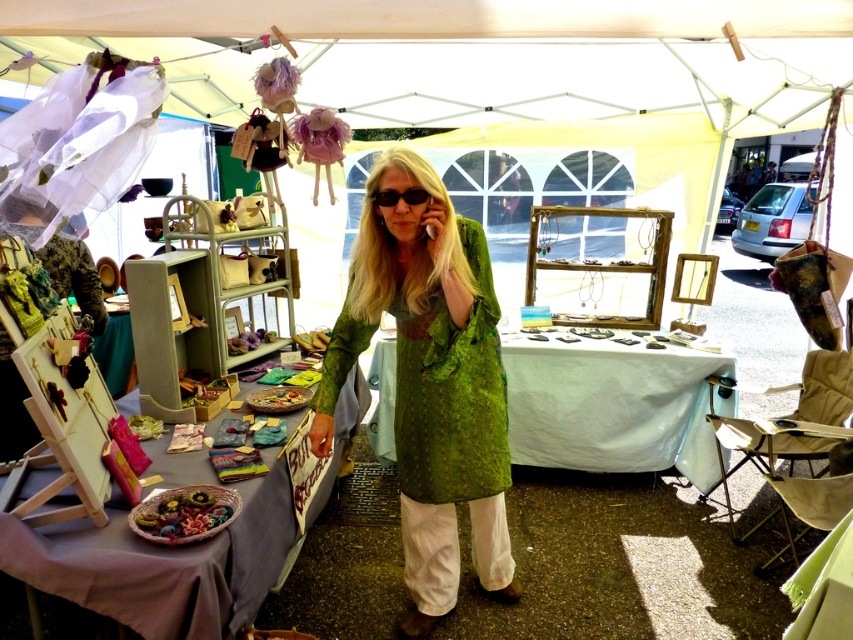
You are a fashion designer observing the market scene. You notice the green textured dress at center and the black plastic goggles at center. Which item is taller?

The green textured dress at center is taller than the black plastic goggles at center.

You are a photographer trying to capture the green textured dress at center and the black plastic goggles at center in a single shot. Which object will appear larger in the photo?

The green textured dress at center will appear larger in the photo because it is closer to the viewer than the black plastic goggles at center.

You are a vendor at the market and want to place both the green textured dress at center and the black plastic goggles at center on a small shelf. Which item should you place first to ensure both fit?

The black plastic goggles at center should be placed first since it is smaller than the green textured dress at center, allowing more space for the larger item afterward.